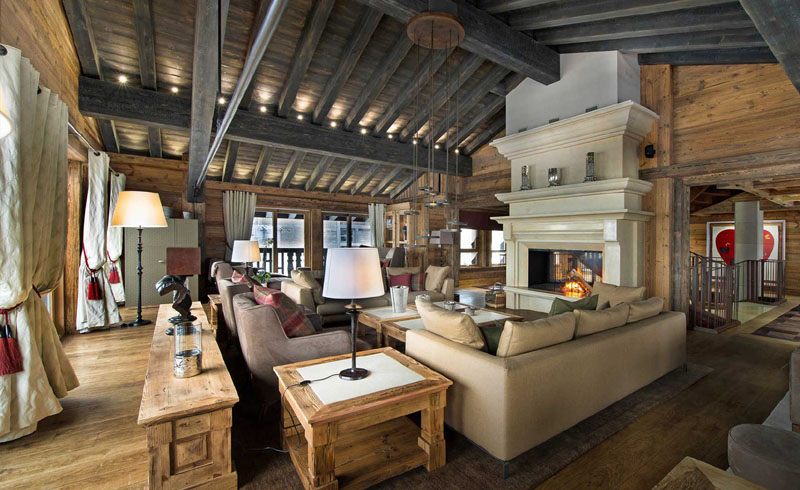
Locate an element on the screen. This screenshot has width=800, height=490. floor is located at coordinates (638, 439).